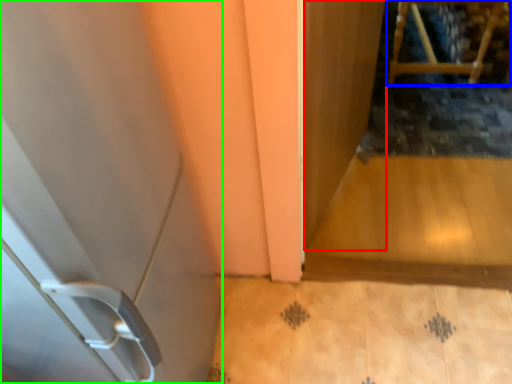
Question: Based on their relative distances, which object is nearer to screen door (highlighted by a red box)? Choose from furniture (highlighted by a blue box) and door (highlighted by a green box).

Choices:
 (A) furniture
 (B) door

Answer: (B)